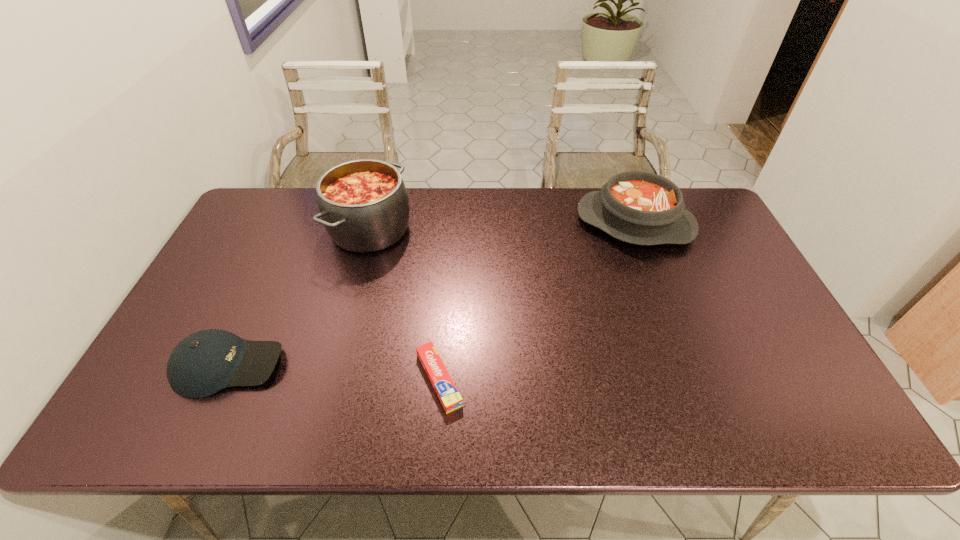
At what (x,y) coordinates should I click in order to perform the action: click on free spot between the baseball cap and the right casserole. Please return your answer as a coordinate pair (x, y). Looking at the image, I should click on (432, 294).

This screenshot has width=960, height=540. Identify the location of free space between the left casserole and the shorter casserole. (502, 226).

Identify the location of free space that is in between the taller casserole and the toothpaste. This screenshot has width=960, height=540. (404, 305).

Where is `free space between the rightmost object and the baseball cap`? This screenshot has width=960, height=540. free space between the rightmost object and the baseball cap is located at coordinates (432, 294).

Locate an element on the screen. This screenshot has width=960, height=540. free space between the taller casserole and the right casserole is located at coordinates (502, 226).

You are a GUI agent. You are given a task and a screenshot of the screen. Output one action in this format:
    pyautogui.click(x=<x>, y=<y>)
    Task: Click on the free space between the baseball cap and the shorter casserole
    The image size is (960, 540).
    Given the screenshot: What is the action you would take?
    pyautogui.click(x=432, y=294)

Where is `free area in between the shortest object and the left casserole`? free area in between the shortest object and the left casserole is located at coordinates (404, 305).

In order to click on vacant point located between the second shortest object and the second object from right to left in this screenshot , I will do `click(334, 373)`.

You are a GUI agent. You are given a task and a screenshot of the screen. Output one action in this format:
    pyautogui.click(x=<x>, y=<y>)
    Task: Click on the vacant point located between the third tallest object and the toothpaste
    The width and height of the screenshot is (960, 540).
    Given the screenshot: What is the action you would take?
    pyautogui.click(x=334, y=373)

At what (x,y) coordinates should I click in order to perform the action: click on vacant space that is in between the third object from left to right and the third tallest object. Please return your answer as a coordinate pair (x, y). Looking at the image, I should click on (334, 373).